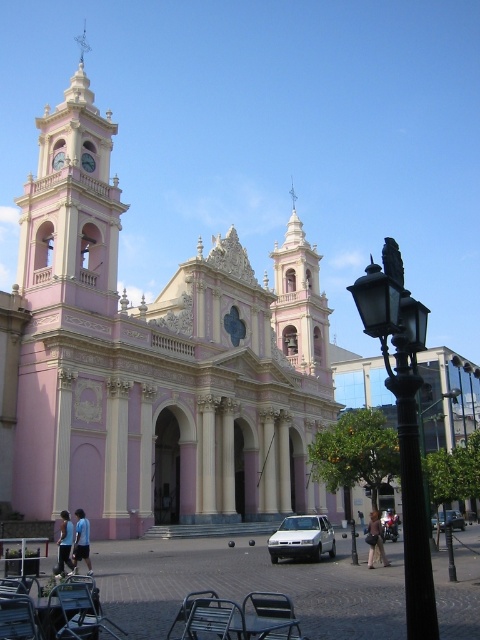
You are a photographer trying to capture the pink matte church at center and the light brown leather jacket at lower center in a single frame. Since you want both subjects to be clearly visible, which object should you focus on first to ensure proper exposure, and why?

You should focus on the pink matte church at center first because it is larger than the light brown leather jacket at lower center, making it the primary subject requiring proper exposure.